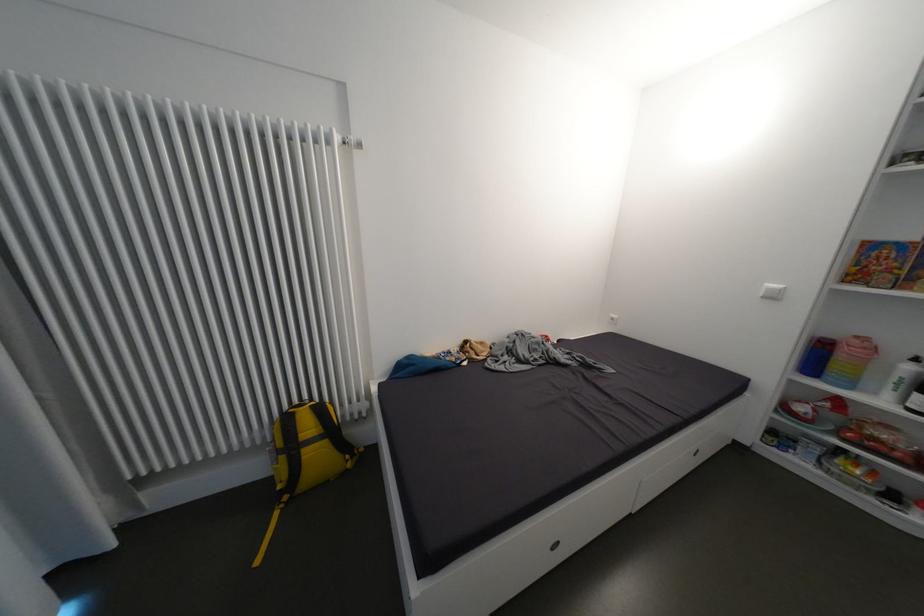
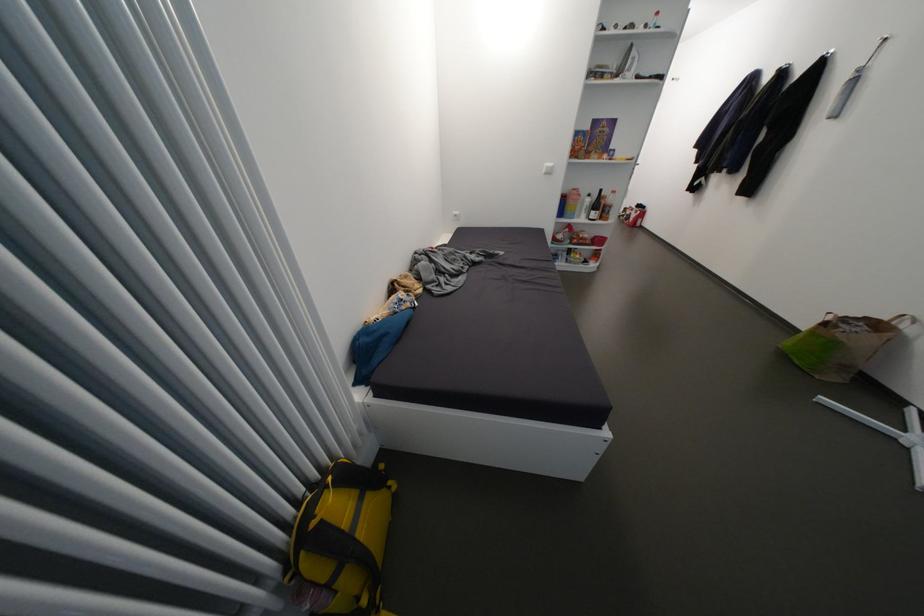
The point at (768, 296) is marked in the first image. Where is the corresponding point in the second image?

(552, 174)